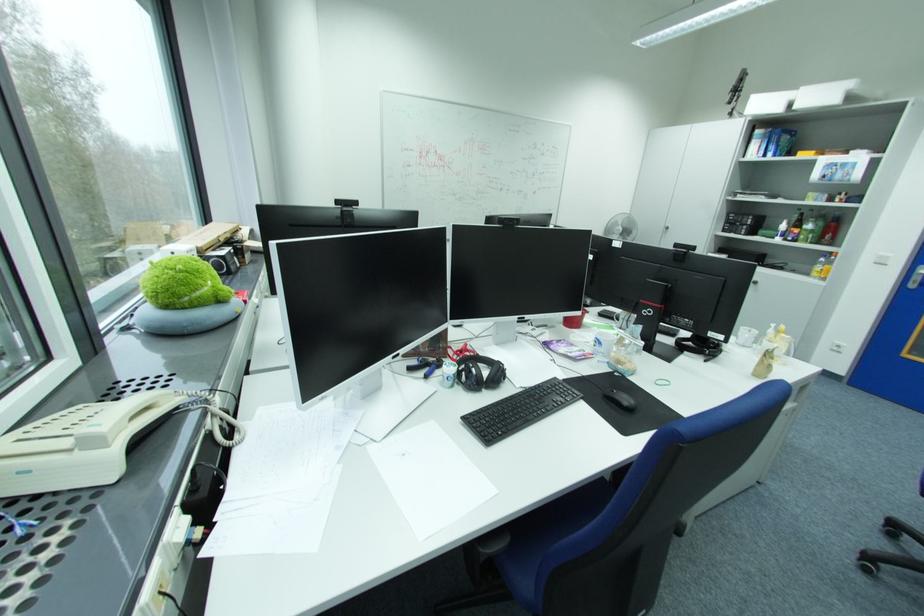
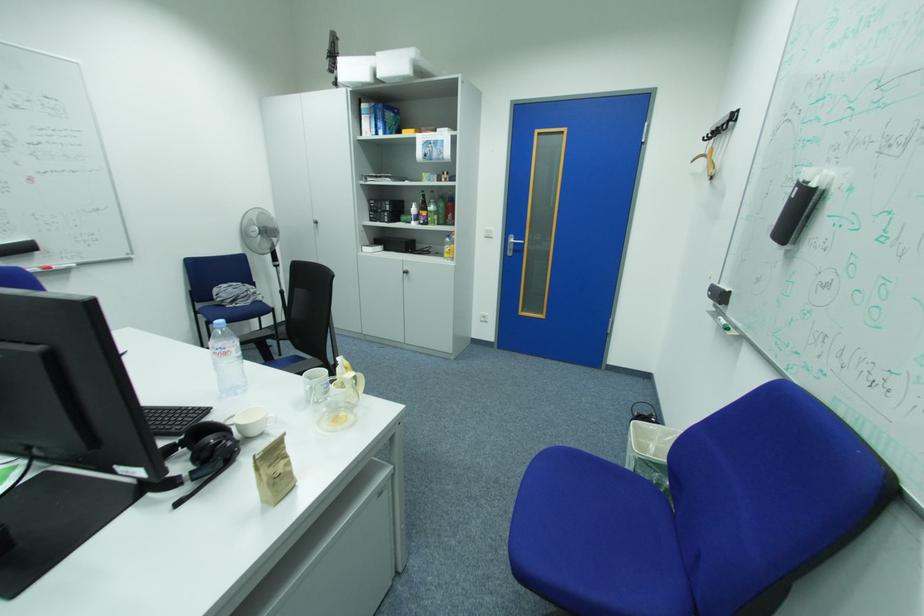
In the second image, find the point that corresponds to point (772, 361) in the first image.

(268, 476)